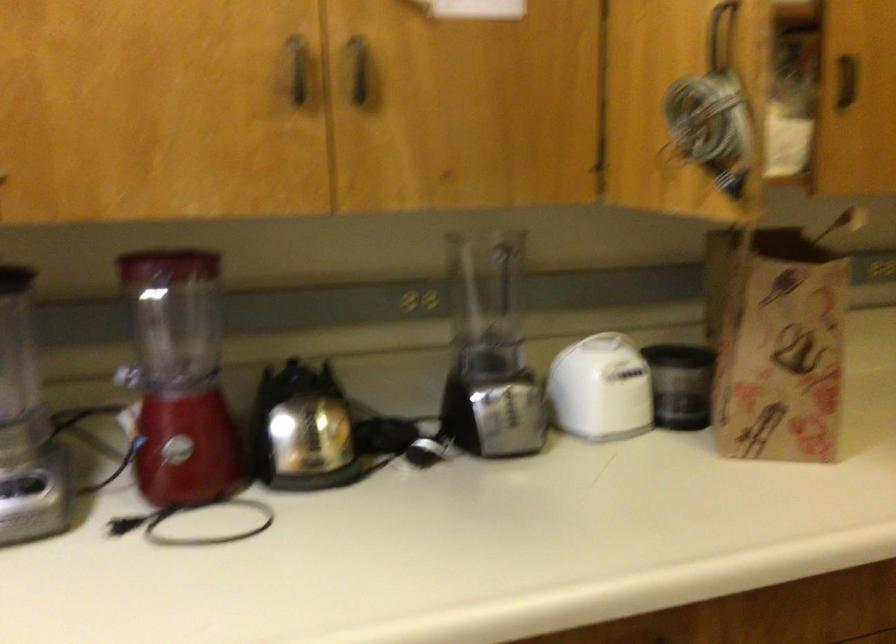
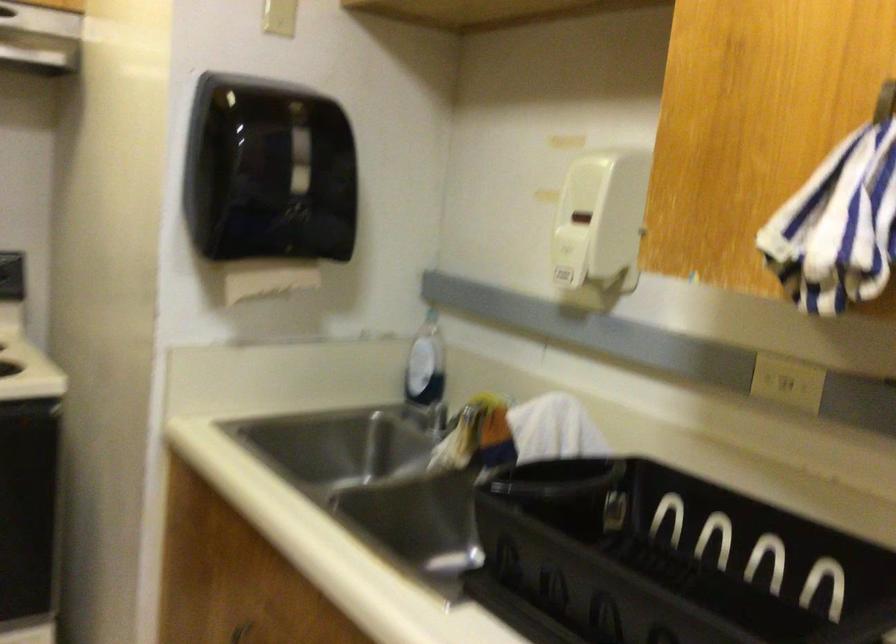
Question: The camera is either moving clockwise (left) or counter-clockwise (right) around the object. The first image is from the beginning of the video and the second image is from the end. Is the camera moving left or right when shooting the video?

Choices:
 (A) Left
 (B) Right

Answer: (A)